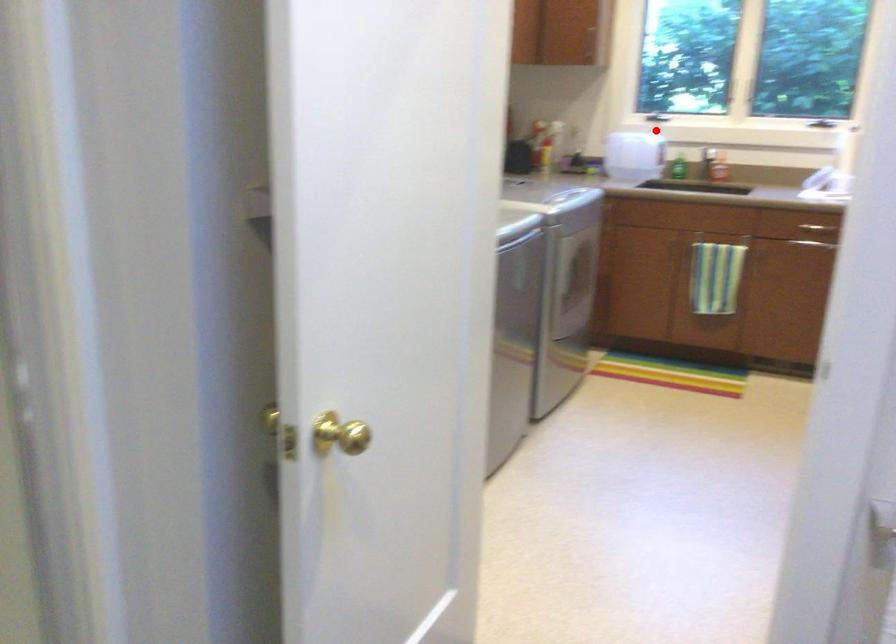
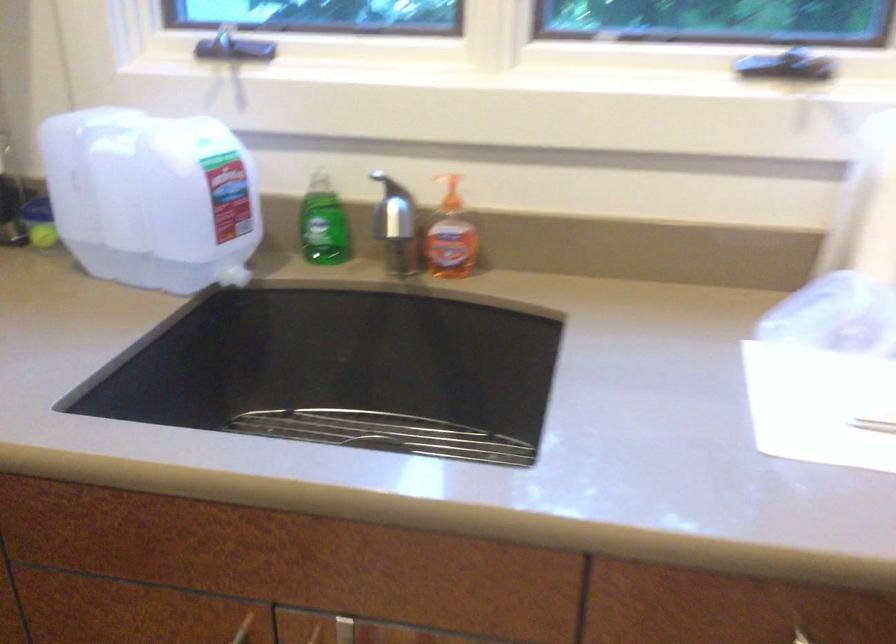
Question: I am providing you with two images of the same scene from different viewpoints. Given a red point in image1, look at the same physical point in image2. Is it:

Choices:
 (A) Closer to the viewpoint
 (B) Farther from the viewpoint

Answer: (A)